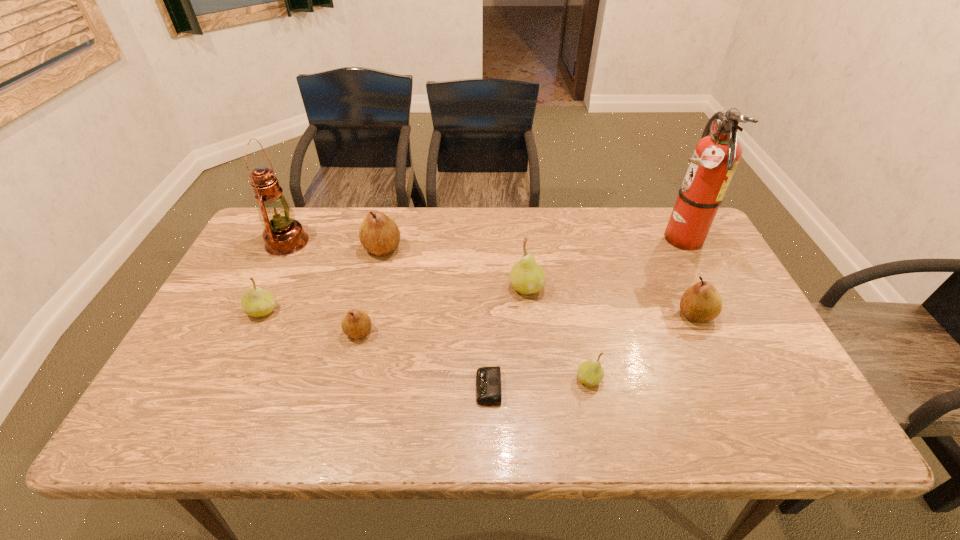
The height and width of the screenshot is (540, 960). In order to click on vacant position located 0.200m on the left of the farthest pear in this screenshot , I will do `click(298, 248)`.

Locate an element on the screen. The width and height of the screenshot is (960, 540). blank area located on the front of the second green pear from right to left is located at coordinates click(542, 441).

Find the location of a particular element. vacant space located 0.130m on the back of the leftmost green pear is located at coordinates pyautogui.click(x=282, y=268).

The width and height of the screenshot is (960, 540). I want to click on free space located 0.190m on the front of the second smallest brown pear, so click(x=732, y=394).

The image size is (960, 540). Identify the location of vacant position located 0.180m on the back of the smallest brown pear. (373, 273).

At what (x,y) coordinates should I click in order to perform the action: click on vacant region located on the left of the rightmost green pear. Please return your answer as a coordinate pair (x, y). The width and height of the screenshot is (960, 540). Looking at the image, I should click on (537, 379).

Find the location of a particular element. Image resolution: width=960 pixels, height=540 pixels. free region located 0.380m on the display of the alarm clock is located at coordinates (310, 388).

Locate an element on the screen. The height and width of the screenshot is (540, 960). vacant position located 0.240m on the display of the alarm clock is located at coordinates (371, 388).

I want to click on vacant space situated on the display of the alarm clock, so click(x=345, y=388).

I want to click on fire extinguisher that is at the far edge, so click(716, 156).